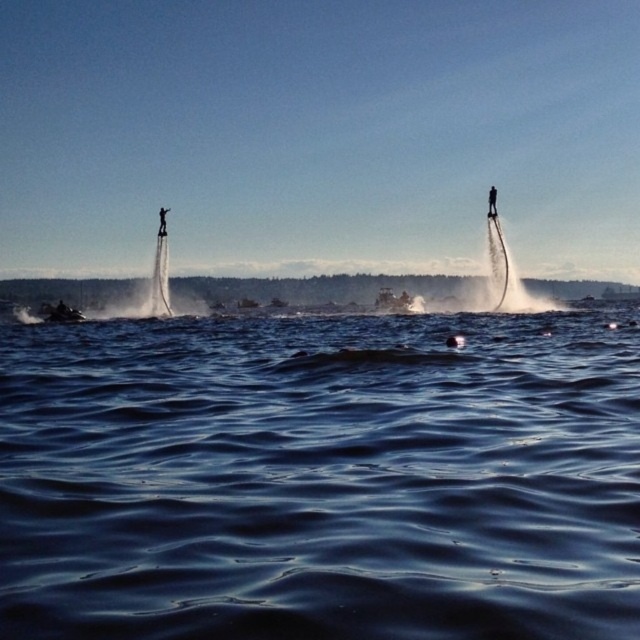
Question: Can you confirm if brushed metal jet ski at lower left is positioned to the left of black matte flyboard at upper right?

Choices:
 (A) yes
 (B) no

Answer: (A)

Question: Does brushed metal jet ski at lower left come behind black matte jetpack at left?

Choices:
 (A) yes
 (B) no

Answer: (B)

Question: Observing the image, what is the correct spatial positioning of dark blue water at center in reference to black matte jetpack at left?

Choices:
 (A) below
 (B) above

Answer: (A)

Question: Which of the following is the farthest from the observer?

Choices:
 (A) black matte flyboard at upper right
 (B) brushed metal jet ski at lower left
 (C) dark blue water at center

Answer: (A)

Question: Which object is farther from the camera taking this photo?

Choices:
 (A) black matte jetpack at left
 (B) dark blue water at center
 (C) black matte flyboard at upper right

Answer: (A)

Question: Which point appears closest to the camera in this image?

Choices:
 (A) (72, 310)
 (B) (364, 572)

Answer: (B)